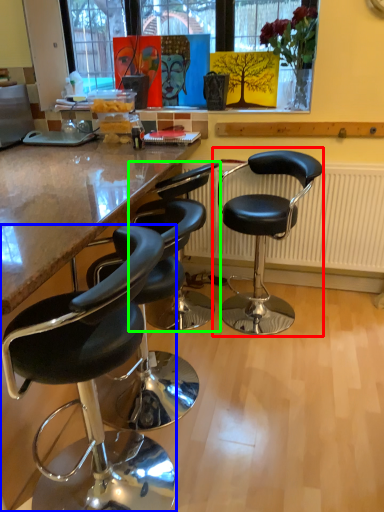
Question: Based on their relative distances, which object is farther from chair (highlighted by a red box)? Choose from chair (highlighted by a blue box) and chair (highlighted by a green box).

Choices:
 (A) chair
 (B) chair

Answer: (A)